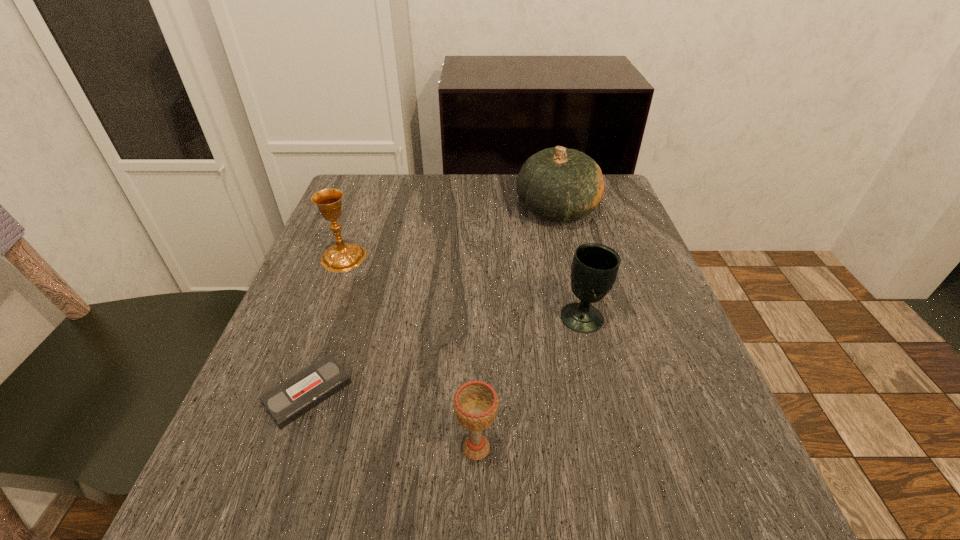
The width and height of the screenshot is (960, 540). I want to click on vacant point located on the back of the third farthest object, so click(568, 258).

Where is `vacant region located on the left of the shortest chalice`? The image size is (960, 540). vacant region located on the left of the shortest chalice is located at coordinates (269, 448).

Find the location of a particular element. vacant space located on the front of the shortest object is located at coordinates (276, 484).

This screenshot has height=540, width=960. I want to click on object that is at the far edge, so click(559, 184).

Where is `chalice that is at the left edge`? The image size is (960, 540). chalice that is at the left edge is located at coordinates (342, 257).

The image size is (960, 540). Find the location of `videotape present at the left edge`. videotape present at the left edge is located at coordinates (286, 402).

At what (x,y) coordinates should I click in order to perform the action: click on gourd at the right edge. Please return your answer as a coordinate pair (x, y). The width and height of the screenshot is (960, 540). Looking at the image, I should click on (559, 184).

Find the location of `chalice positioned at the right edge`. chalice positioned at the right edge is located at coordinates (594, 268).

Locate an element on the screen. This screenshot has width=960, height=540. object present at the far right corner is located at coordinates (559, 184).

In the image, there is a desktop. Where is `vacant space at the far edge`? This screenshot has width=960, height=540. vacant space at the far edge is located at coordinates (457, 222).